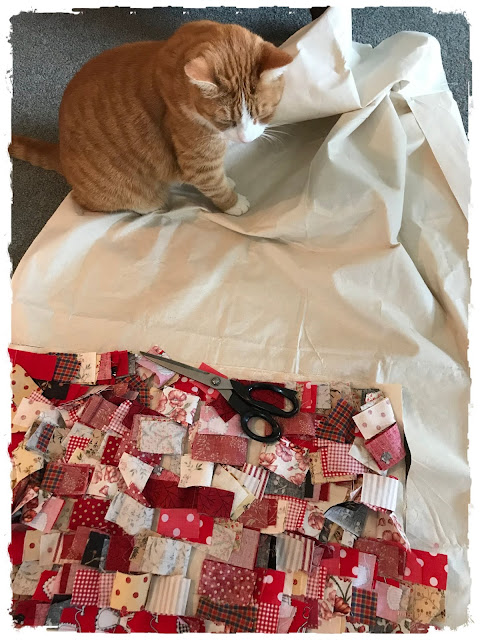
Where is `quilt fabric`? The width and height of the screenshot is (480, 640). quilt fabric is located at coordinates (205, 498).